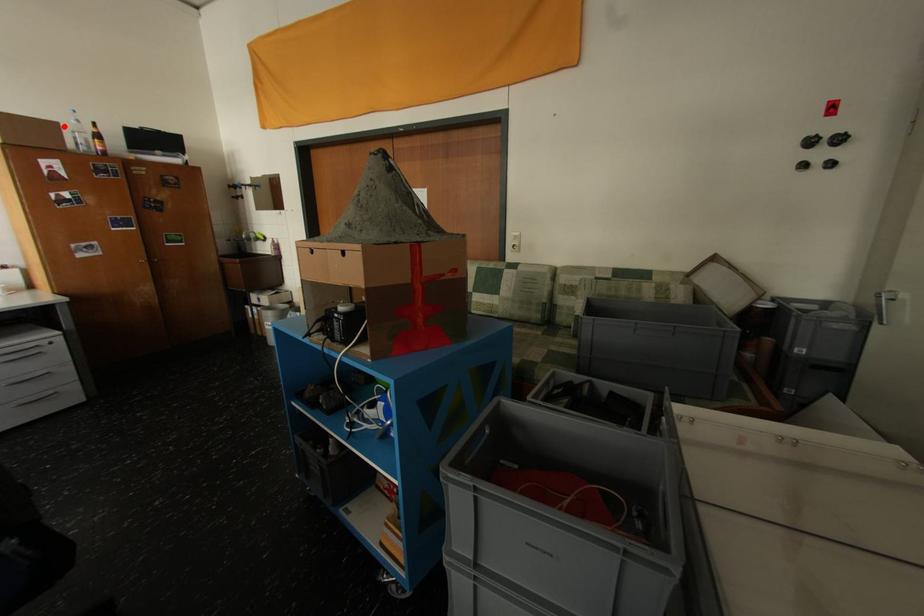
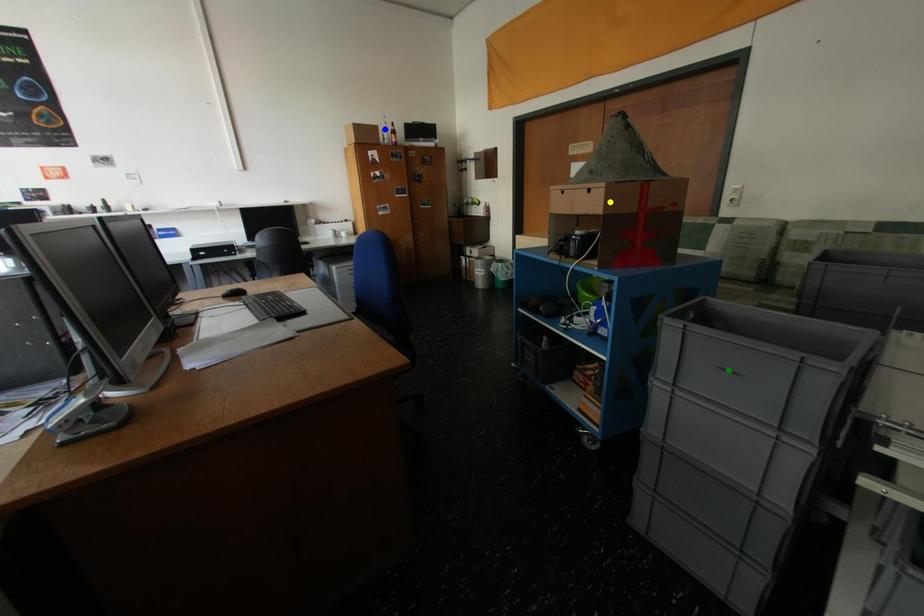
Question: I am providing you with two images of the same scene from different viewpoints. A red point is marked on the first image. You are given multiple points on the second image. Which mark in image 2 goes with the point in image 1?

Choices:
 (A) green point
 (B) blue point
 (C) yellow point

Answer: (B)